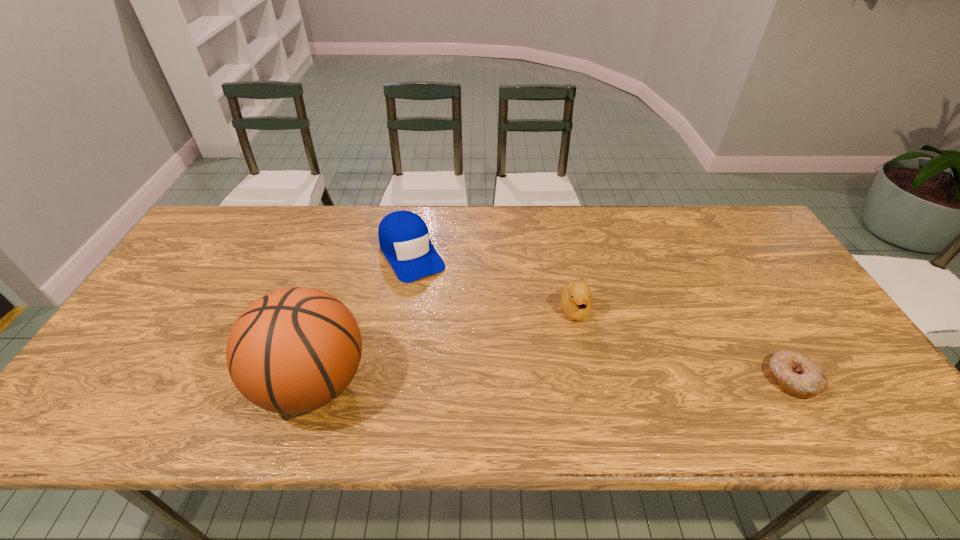
In order to click on basketball in this screenshot , I will do `click(292, 351)`.

Identify the location of the rightmost object. This screenshot has height=540, width=960. (798, 375).

The width and height of the screenshot is (960, 540). I want to click on doughnut, so click(798, 375).

The height and width of the screenshot is (540, 960). Find the location of `baseball cap`. baseball cap is located at coordinates (404, 238).

Where is `the third object from left to right`? the third object from left to right is located at coordinates (575, 297).

Locate an element on the screen. the third nearest object is located at coordinates (575, 297).

Where is `vacant region located 0.310m on the right of the basketball`? vacant region located 0.310m on the right of the basketball is located at coordinates (503, 382).

This screenshot has height=540, width=960. Find the location of `vacant space located 0.080m on the back of the rightmost object`. vacant space located 0.080m on the back of the rightmost object is located at coordinates (764, 332).

Where is `vacant space positioned 0.260m on the front-facing side of the baseball cap`? vacant space positioned 0.260m on the front-facing side of the baseball cap is located at coordinates (464, 344).

Identify the location of blank area located on the front-facing side of the baseball cap. (443, 309).